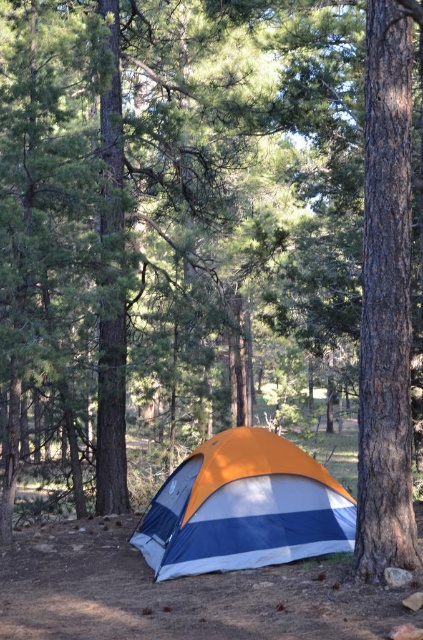
You are a hiker who wants to take a photo of the smooth brown tree trunk at right from the position of the point marked at point (386, 301). Is the smooth brown tree trunk at right visible from this point?

The point (386, 301) marks the smooth brown tree trunk at right, so yes, it is visible from that point.